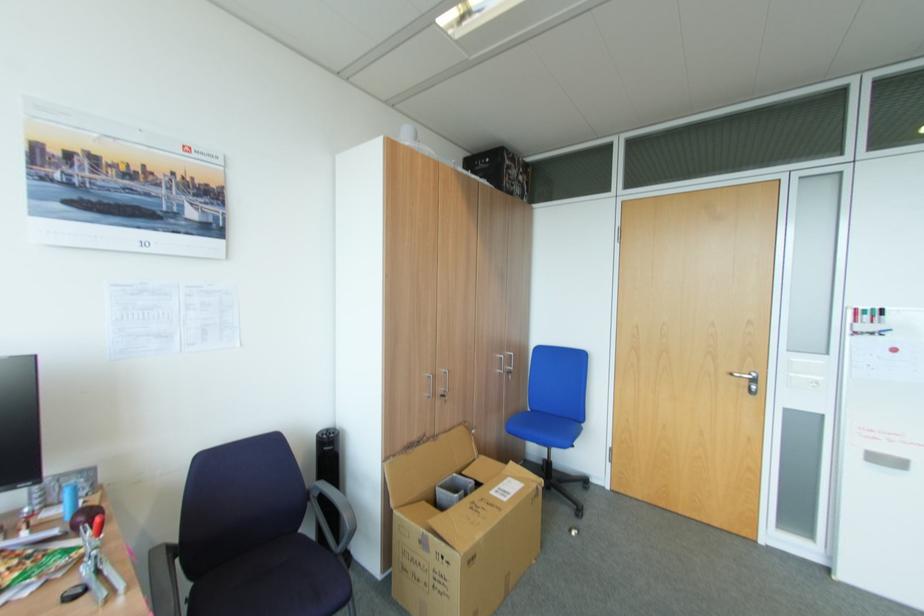
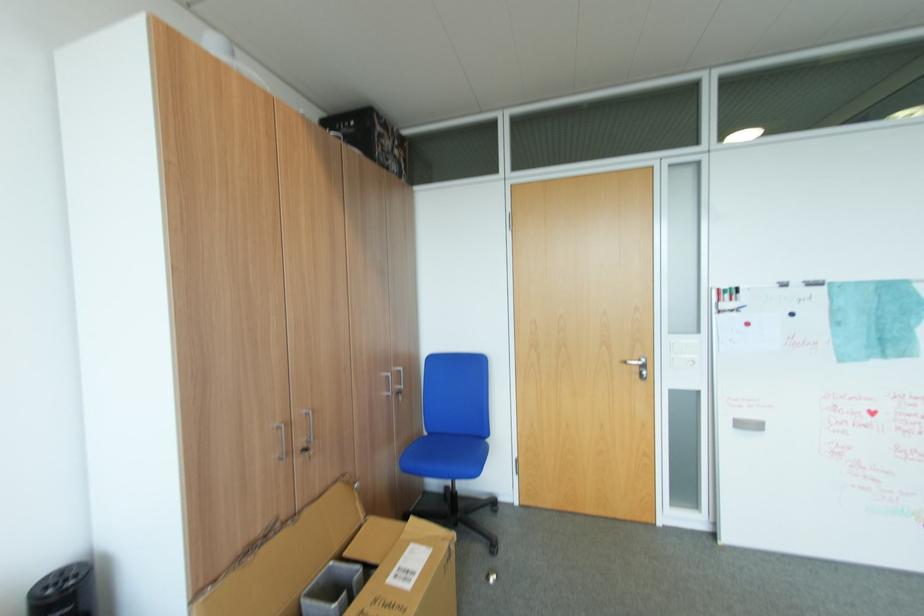
In the second image, find the point that corresponds to point (448, 395) in the first image.

(310, 451)